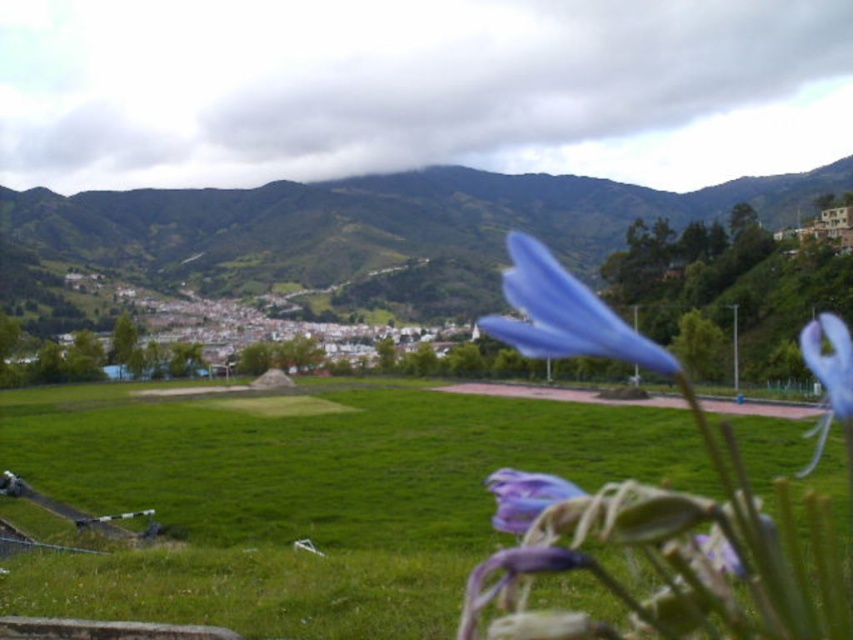
Question: Which object is closer to the camera taking this photo?

Choices:
 (A) blue matte flower at center
 (B) green grassy field at center
 (C) purple matte flower at lower center
 (D) green grassy field at lower center

Answer: (B)

Question: Is green grassy field at lower center to the left of purple matte flower at center from the viewer's perspective?

Choices:
 (A) yes
 (B) no

Answer: (A)

Question: Is green grassy field at lower center thinner than purple matte flower at center?

Choices:
 (A) yes
 (B) no

Answer: (B)

Question: Which is farther from the purple matte flower at lower center?

Choices:
 (A) blue matte flower at center
 (B) green grassy field at center

Answer: (A)

Question: Is green grassy field at lower center below purple matte flower at lower center?

Choices:
 (A) yes
 (B) no

Answer: (B)

Question: Considering the real-world distances, which object is farthest from the purple matte flower at lower center?

Choices:
 (A) green grassy field at center
 (B) green grassy field at lower center
 (C) blue matte flower at center
 (D) purple matte flower at center

Answer: (B)